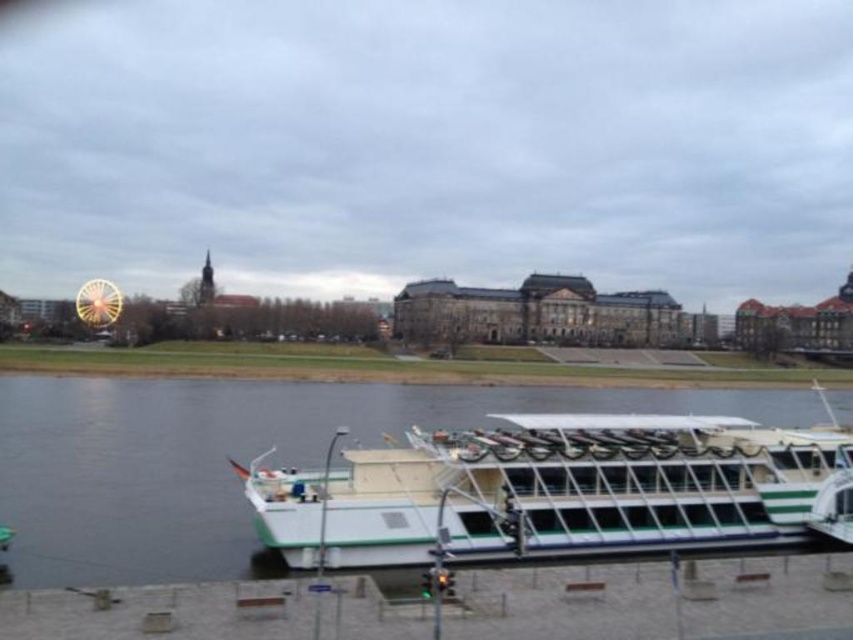
Question: Does white matte boat at lower center have a greater width compared to shiny yellow ferris wheel at left?

Choices:
 (A) yes
 (B) no

Answer: (B)

Question: Is white matte boat at lower center positioned before shiny yellow ferris wheel at left?

Choices:
 (A) yes
 (B) no

Answer: (A)

Question: Among these objects, which one is farthest from the camera?

Choices:
 (A) shiny yellow ferris wheel at left
 (B) white matte boat at lower center

Answer: (A)

Question: Is white matte boat at lower center to the right of shiny yellow ferris wheel at left from the viewer's perspective?

Choices:
 (A) no
 (B) yes

Answer: (A)